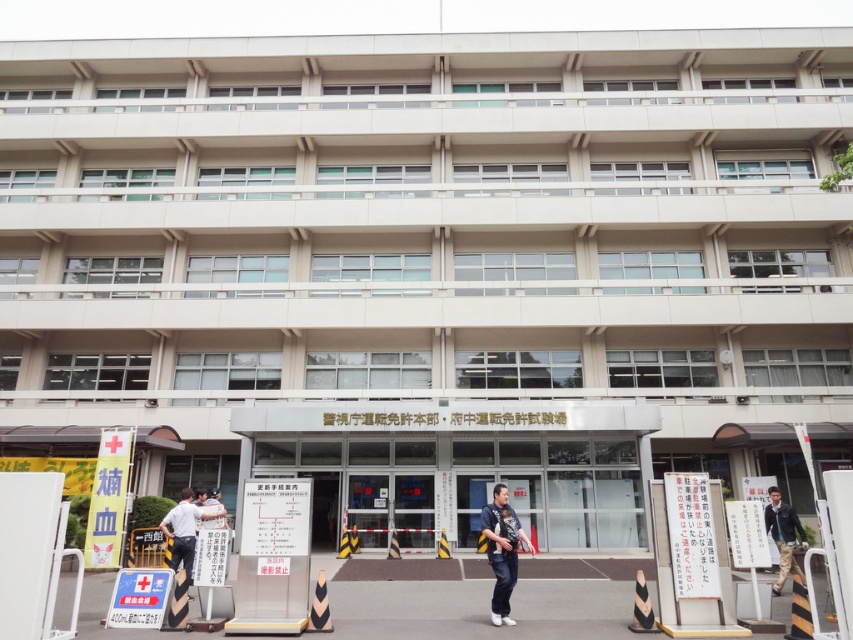
Who is higher up, dark blue jeans at center or dark blue jacket at center?

dark blue jeans at center is above.

Is dark blue jeans at center smaller than dark blue jacket at center?

Yes.

Which is in front, point (492, 554) or point (791, 552)?

Point (492, 554) is more forward.

Locate an element on the screen. dark blue jeans at center is located at coordinates (502, 550).